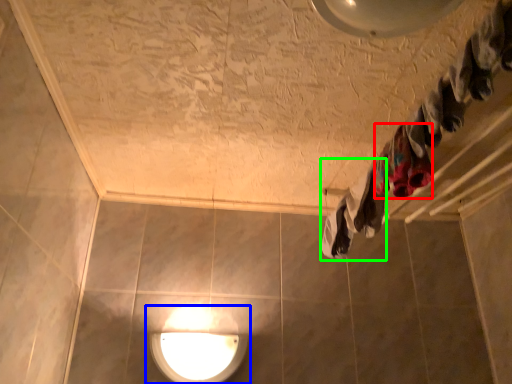
Question: Which object is the closest to the clothing (highlighted by a red box)? Choose among these: lamp (highlighted by a blue box) or clothing (highlighted by a green box).

Choices:
 (A) lamp
 (B) clothing

Answer: (B)